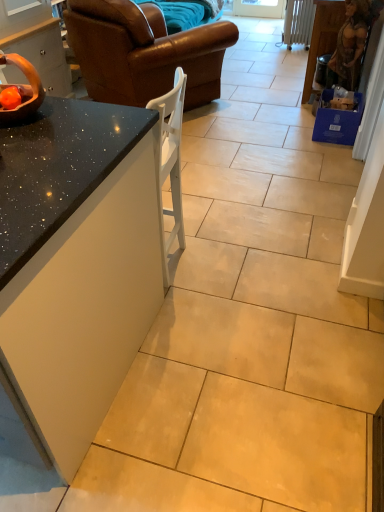
Question: Considering the relative positions of brown leather couch at upper left and matte black bowl at left, which appears as the 1th cabinetry when viewed from the left, in the image provided, is brown leather couch at upper left to the right of matte black bowl at left, which appears as the 1th cabinetry when viewed from the left, from the viewer's perspective?

Choices:
 (A) no
 (B) yes

Answer: (B)

Question: Can matte black bowl at left, which appears as the 1th cabinetry when viewed from the left, be found inside brown leather couch at upper left?

Choices:
 (A) yes
 (B) no

Answer: (B)

Question: Considering the relative sizes of brown leather couch at upper left and matte black bowl at left, which appears as the 1th cabinetry when viewed from the left, in the image provided, is brown leather couch at upper left bigger than matte black bowl at left, which appears as the 1th cabinetry when viewed from the left,?

Choices:
 (A) no
 (B) yes

Answer: (B)

Question: Is brown leather couch at upper left behind matte black bowl at left, which is counted as the second cabinetry, starting from the right?

Choices:
 (A) yes
 (B) no

Answer: (A)

Question: Can you confirm if brown leather couch at upper left is smaller than matte black bowl at left, which appears as the 1th cabinetry when viewed from the left?

Choices:
 (A) yes
 (B) no

Answer: (B)

Question: Could you tell me if brown leather couch at upper left is facing matte black bowl at left, which appears as the 1th cabinetry when viewed from the left?

Choices:
 (A) no
 (B) yes

Answer: (A)

Question: Does matte black bowl at left, which is counted as the second cabinetry, starting from the right, have a greater height compared to brown leather couch at upper left?

Choices:
 (A) no
 (B) yes

Answer: (A)

Question: Does matte black bowl at left, which is counted as the second cabinetry, starting from the right, have a larger size compared to brown leather couch at upper left?

Choices:
 (A) yes
 (B) no

Answer: (B)

Question: Is matte black bowl at left, which is counted as the second cabinetry, starting from the right, positioned in front of brown leather couch at upper left?

Choices:
 (A) no
 (B) yes

Answer: (B)

Question: From a real-world perspective, is matte black bowl at left, which is counted as the second cabinetry, starting from the right, positioned under brown leather couch at upper left based on gravity?

Choices:
 (A) yes
 (B) no

Answer: (B)

Question: Is matte black bowl at left, which appears as the 1th cabinetry when viewed from the left, next to brown leather couch at upper left?

Choices:
 (A) no
 (B) yes

Answer: (A)

Question: Can you confirm if matte black bowl at left, which is counted as the second cabinetry, starting from the right, is smaller than brown leather couch at upper left?

Choices:
 (A) no
 (B) yes

Answer: (B)

Question: Considering the relative positions of matte black bowl at left, which appears as the 1th cabinetry when viewed from the left, and wooden bowl at upper left in the image provided, is matte black bowl at left, which appears as the 1th cabinetry when viewed from the left, to the left of wooden bowl at upper left from the viewer's perspective?

Choices:
 (A) no
 (B) yes

Answer: (B)